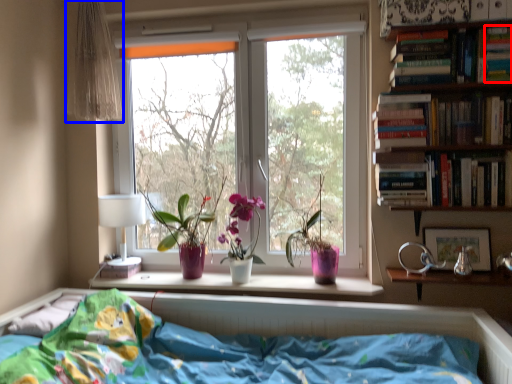
Question: Which object is closer to the camera taking this photo, paperback book (highlighted by a red box) or curtain (highlighted by a blue box)?

Choices:
 (A) paperback book
 (B) curtain

Answer: (A)